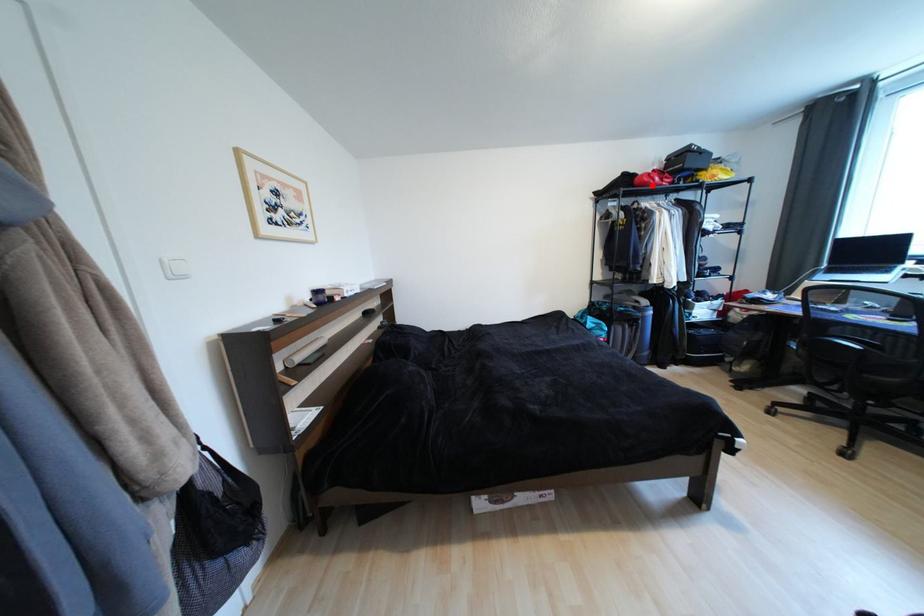
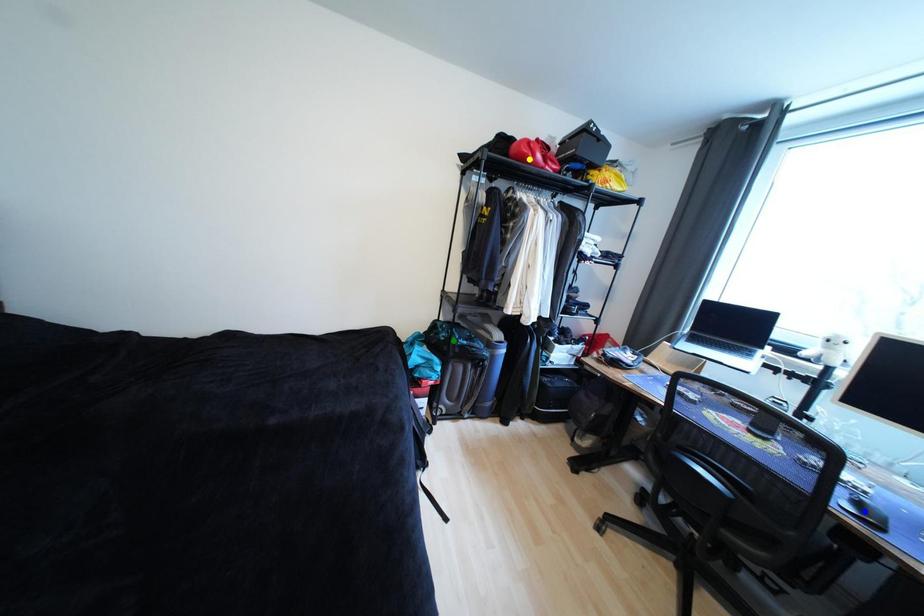
Question: I am providing you with two images of the same scene from different viewpoints. A red point is marked on the first image. You are given multiple points on the second image. Can you choose the point in image 2 that corresponds to the point in image 1?

Choices:
 (A) green point
 (B) blue point
 (C) yellow point

Answer: (C)